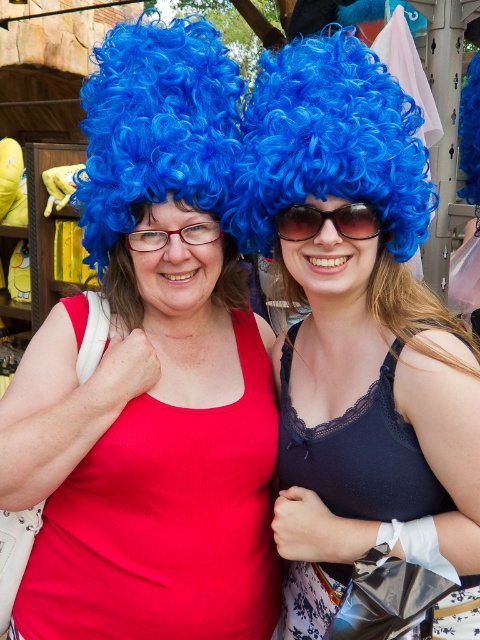
Question: Which point is farther to the camera?

Choices:
 (A) (286, 246)
 (B) (215, 172)
 (C) (310, 237)
 (D) (216, 220)

Answer: (D)

Question: Is matte blue wig at center below blue curly wig at upper center?

Choices:
 (A) no
 (B) yes

Answer: (B)

Question: Which of the following is the farthest from the observer?

Choices:
 (A) (372, 220)
 (B) (325, 602)
 (C) (177, 188)

Answer: (B)

Question: In this image, where is blue curly wig at center located relative to lace fabric dress at center?

Choices:
 (A) right
 (B) left

Answer: (A)

Question: Is matte blue wig at center further to the viewer compared to sunglasses at center?

Choices:
 (A) yes
 (B) no

Answer: (A)

Question: Based on their relative distances, which object is nearer to the lace fabric dress at center?

Choices:
 (A) matte blue wig at center
 (B) blue curly wig at upper center

Answer: (A)